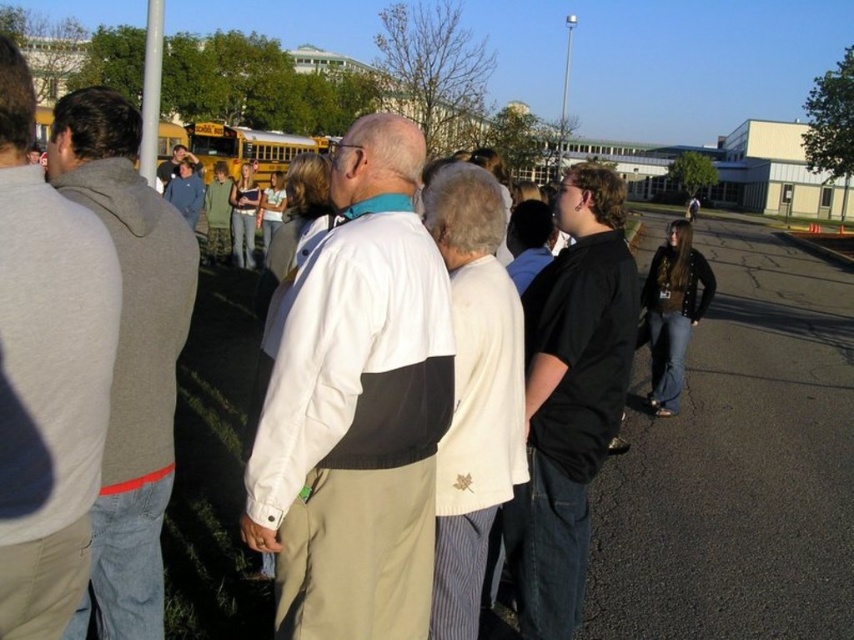
You are a photographer trying to capture a group photo of the black matte shirt at center and the matte black shirt at center. Which one should you focus on to ensure it takes up more of the frame?

The matte black shirt at center should be focused on since it occupies more space than the black matte shirt at center, making it larger in the frame.

You are a photographer trying to capture a clear photo of the black matte shirt at center. However, the gray fleece sweatshirt at left is blocking your view. Can you adjust your position to the right to get an unobstructed shot?

The gray fleece sweatshirt at left is positioned over the black matte shirt at center, so moving to the right might not help. You should move to the left to get an unobstructed view of the black matte shirt at center.